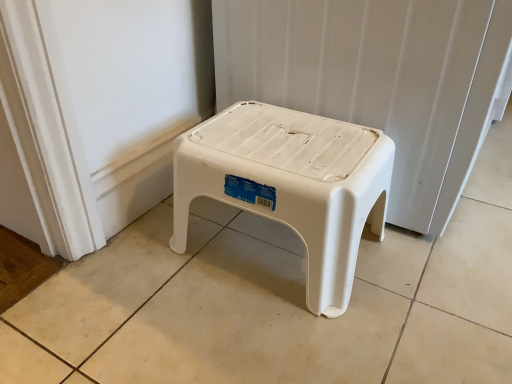
Question: Considering the relative sizes of white plastic stool at center and white plastic stool at center in the image provided, is white plastic stool at center thinner than white plastic stool at center?

Choices:
 (A) no
 (B) yes

Answer: (A)

Question: Are white plastic stool at center and white plastic stool at center making contact?

Choices:
 (A) no
 (B) yes

Answer: (A)

Question: Is white plastic stool at center positioned beyond the bounds of white plastic stool at center?

Choices:
 (A) no
 (B) yes

Answer: (B)

Question: Is white plastic stool at center to the right of white plastic stool at center from the viewer's perspective?

Choices:
 (A) no
 (B) yes

Answer: (B)

Question: Does white plastic stool at center turn towards white plastic stool at center?

Choices:
 (A) yes
 (B) no

Answer: (B)

Question: From a real-world perspective, is white plastic stool at center on top of white plastic stool at center?

Choices:
 (A) yes
 (B) no

Answer: (A)

Question: From a real-world perspective, is white plastic stool at center under white plastic stool at center?

Choices:
 (A) no
 (B) yes

Answer: (B)

Question: Considering the relative sizes of white plastic stool at center and white plastic stool at center in the image provided, is white plastic stool at center shorter than white plastic stool at center?

Choices:
 (A) no
 (B) yes

Answer: (B)

Question: Is white plastic stool at center facing towards white plastic stool at center?

Choices:
 (A) no
 (B) yes

Answer: (A)

Question: From a real-world perspective, does white plastic stool at center stand above white plastic stool at center?

Choices:
 (A) yes
 (B) no

Answer: (B)

Question: From the image's perspective, is white plastic stool at center on white plastic stool at center?

Choices:
 (A) no
 (B) yes

Answer: (A)

Question: Considering the relative sizes of white plastic stool at center and white plastic stool at center in the image provided, is white plastic stool at center taller than white plastic stool at center?

Choices:
 (A) yes
 (B) no

Answer: (B)

Question: In terms of height, does white plastic stool at center look taller or shorter compared to white plastic stool at center?

Choices:
 (A) short
 (B) tall

Answer: (A)